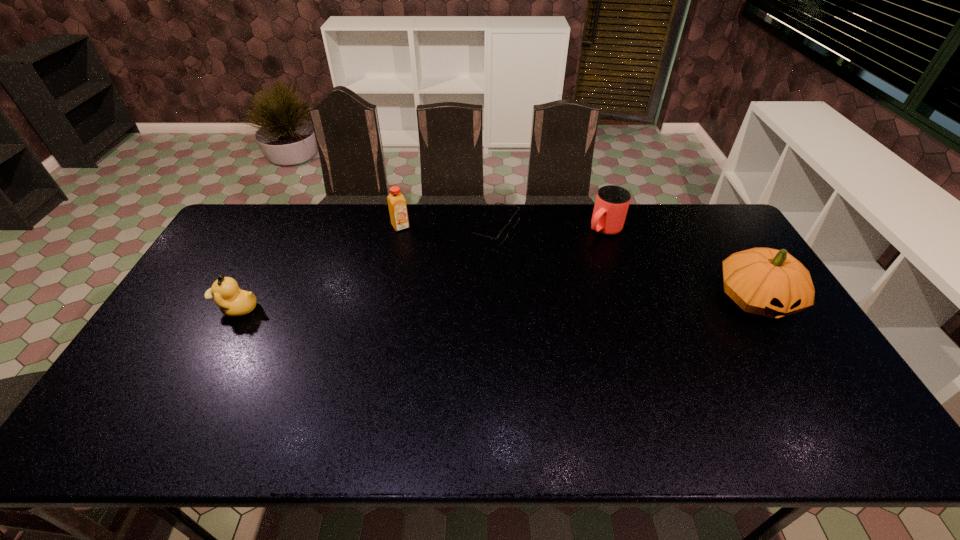
At what (x,y) coordinates should I click in order to perform the action: click on vacant space that is in between the tallest object and the cup. Please return your answer as a coordinate pair (x, y). This screenshot has height=540, width=960. Looking at the image, I should click on (680, 265).

Where is `empty space between the leftmost object and the cup`? empty space between the leftmost object and the cup is located at coordinates click(420, 269).

Locate an element on the screen. free area in between the cup and the third object from left to right is located at coordinates (550, 230).

What are the coordinates of `vacant point located between the cup and the rightmost object` in the screenshot? It's located at (680, 265).

You are a GUI agent. You are given a task and a screenshot of the screen. Output one action in this format:
    pyautogui.click(x=<x>, y=<y>)
    Task: Click on the free space between the duckling and the third object from left to right
    
    Given the screenshot: What is the action you would take?
    pyautogui.click(x=367, y=269)

You are a GUI agent. You are given a task and a screenshot of the screen. Output one action in this format:
    pyautogui.click(x=<x>, y=<y>)
    Task: Click on the unoccupied area between the leftmost object and the gourd
    
    Given the screenshot: What is the action you would take?
    pyautogui.click(x=496, y=304)

At what (x,y) coordinates should I click in order to perform the action: click on vacant space that is in between the second object from left to right and the fourth object from left to right. Please return your answer as a coordinate pair (x, y). The width and height of the screenshot is (960, 540). Looking at the image, I should click on (502, 228).

What are the coordinates of `vacant area that lies between the second object from left to right and the spectacles` in the screenshot? It's located at (448, 228).

Identify which object is the fourth closest to the second object from right to left. Please provide its 2D coordinates. Your answer should be formatted as a tuple, i.e. [(x, y)], where the tuple contains the x and y coordinates of a point satisfying the conditions above.

[(233, 302)]

Select which object appears as the third closest to the orange juice. Please provide its 2D coordinates. Your answer should be formatted as a tuple, i.e. [(x, y)], where the tuple contains the x and y coordinates of a point satisfying the conditions above.

[(612, 202)]